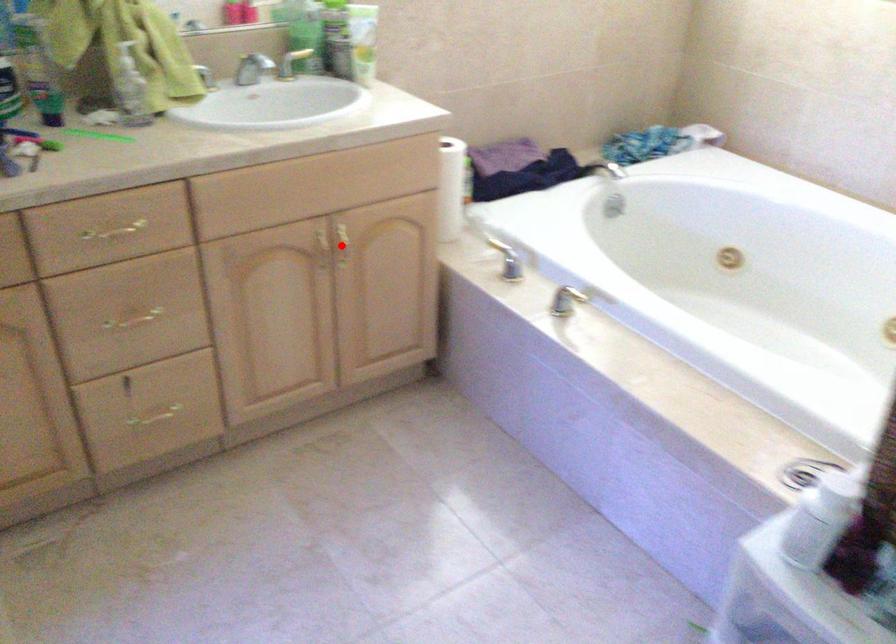
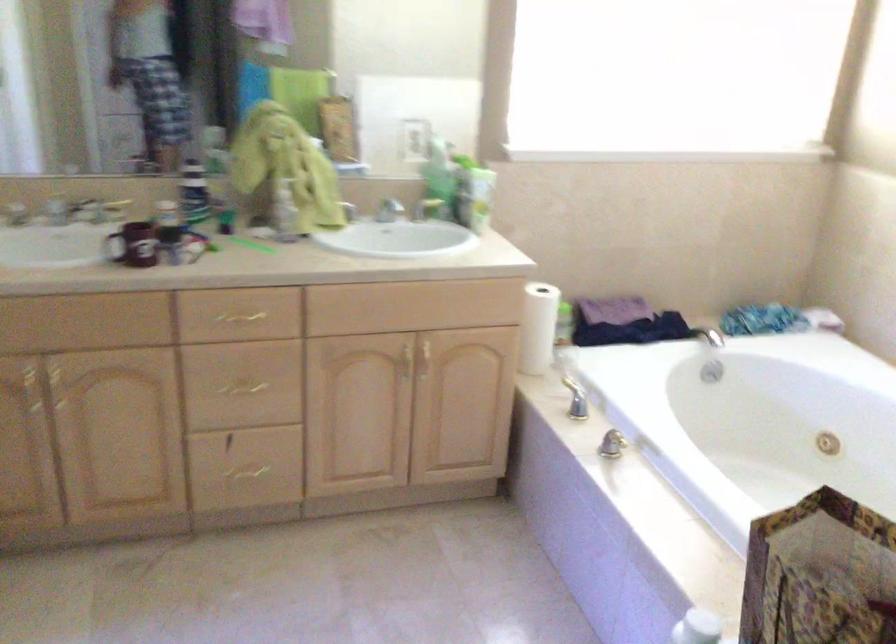
Where in the second image is the point corresponding to the highlighted location from the first image?

(424, 359)